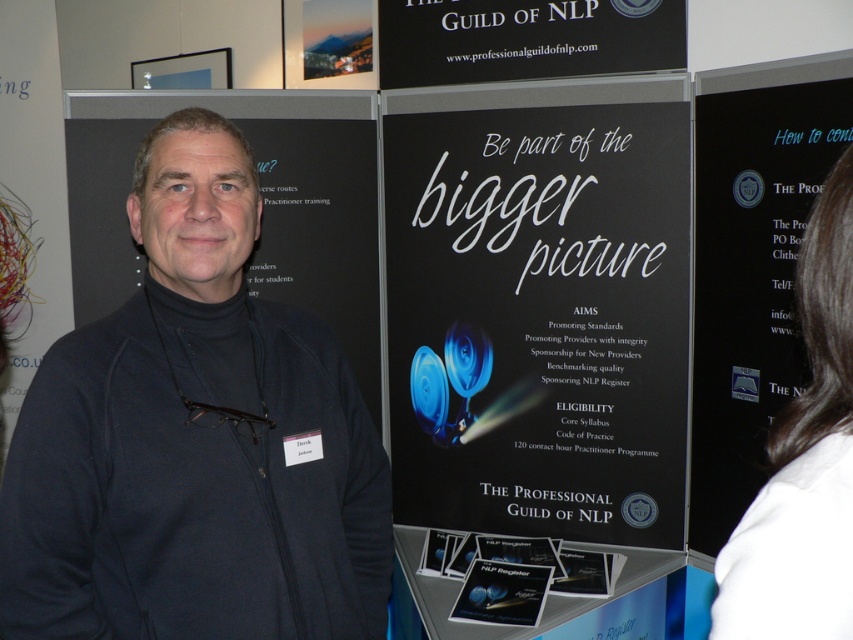
Based on the scene description, which object is larger? The dark blue fleece at left or the black paper poster at center?

The black paper poster at center is larger because the dark blue fleece at left is smaller than it according to the description.

You are a visitor at the conference and want to read the text on the black paper poster at center. Can you read it clearly from your current position?

The black paper poster at center is 1.85 meters away from viewer, so yes, you can read it clearly from this distance.

You are attending a conference and want to read both the black paper poster at center and the black matte sign at upper center at the booth. Which one should you move closer to first?

You should move closer to the black paper poster at center first because it is closer to you than the black matte sign at upper center, which is further away.